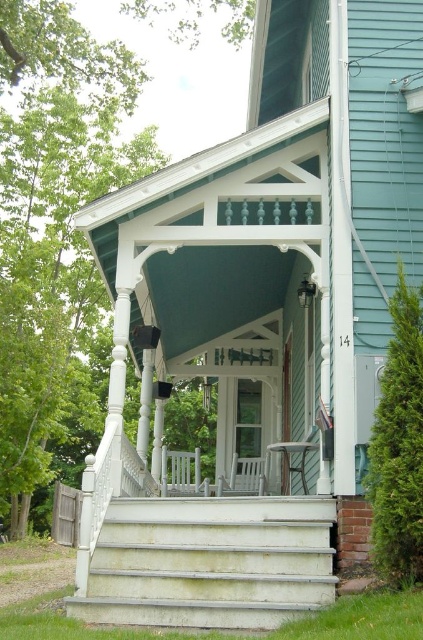
Question: Is gray concrete stairs at center wider than white wood rocking chair at center?

Choices:
 (A) yes
 (B) no

Answer: (A)

Question: Which point appears closest to the camera in this image?

Choices:
 (A) (247, 474)
 (B) (154, 515)

Answer: (B)

Question: Is gray concrete stairs at center positioned before white wood rocking chair at center?

Choices:
 (A) no
 (B) yes

Answer: (B)

Question: Which point is closer to the camera?

Choices:
 (A) white wood rocking chair at center
 (B) gray concrete stairs at center

Answer: (B)

Question: Which of the following is the closest to the observer?

Choices:
 (A) (316, 582)
 (B) (230, 480)

Answer: (A)

Question: Can you confirm if gray concrete stairs at center is positioned above white wood rocking chair at center?

Choices:
 (A) yes
 (B) no

Answer: (A)